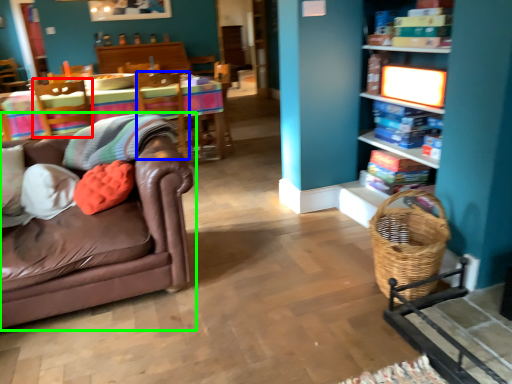
Question: Estimate the real-world distances between objects in this image. Which object is closer to swivel chair (highlighted by a red box), swivel chair (highlighted by a blue box) or studio couch (highlighted by a green box)?

Choices:
 (A) swivel chair
 (B) studio couch

Answer: (A)